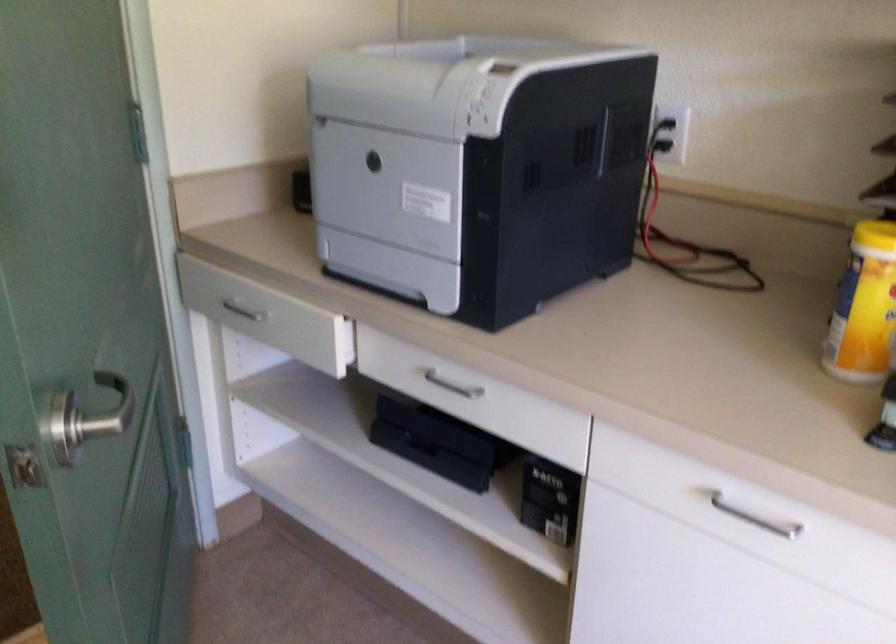
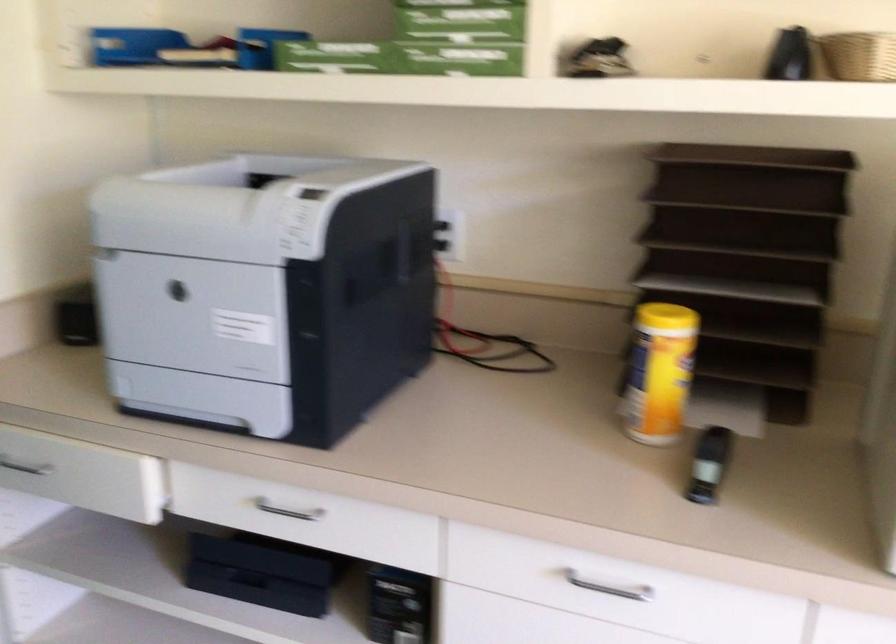
Question: The images are taken continuously from a first-person perspective. In which direction is your viewpoint rotating?

Choices:
 (A) Left
 (B) Right
 (C) Up
 (D) Down

Answer: (B)